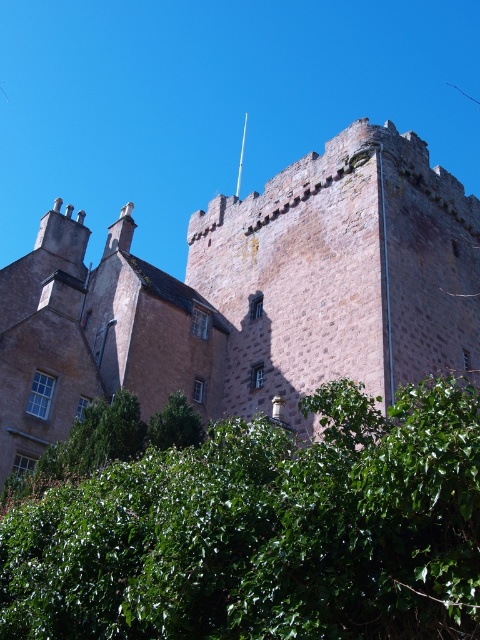
Question: Can you confirm if brown stone tower at upper center is wider than green leafy bush at lower center?

Choices:
 (A) no
 (B) yes

Answer: (B)

Question: Can you confirm if green leafy bush at lower center is wider than green leafy tree at lower center?

Choices:
 (A) no
 (B) yes

Answer: (B)

Question: Which object is positioned farthest from the green leafy tree at lower center?

Choices:
 (A) brown stone tower at upper center
 (B) green leafy bush at lower center

Answer: (B)

Question: Does brown stone tower at upper center appear on the right side of green leafy tree at lower center?

Choices:
 (A) no
 (B) yes

Answer: (B)

Question: Estimate the real-world distances between objects in this image. Which object is closer to the brown stone tower at upper center?

Choices:
 (A) green leafy bush at lower center
 (B) green leafy tree at lower center

Answer: (A)

Question: Among these points, which one is farthest from the camera?

Choices:
 (A) (171, 442)
 (B) (456, 232)

Answer: (B)